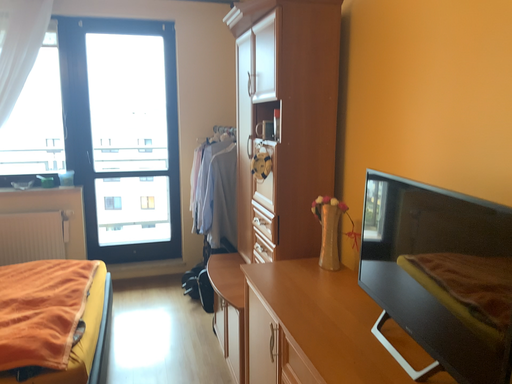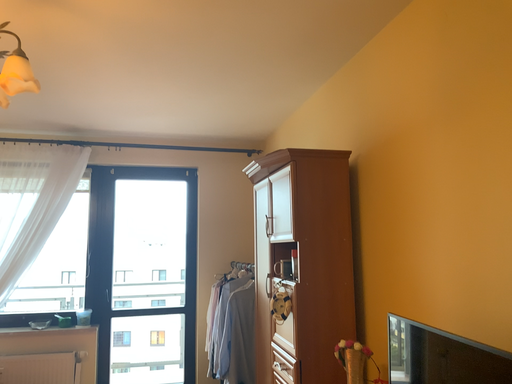
Question: How did the camera likely rotate when shooting the video?

Choices:
 (A) rotated downward
 (B) rotated upward

Answer: (B)